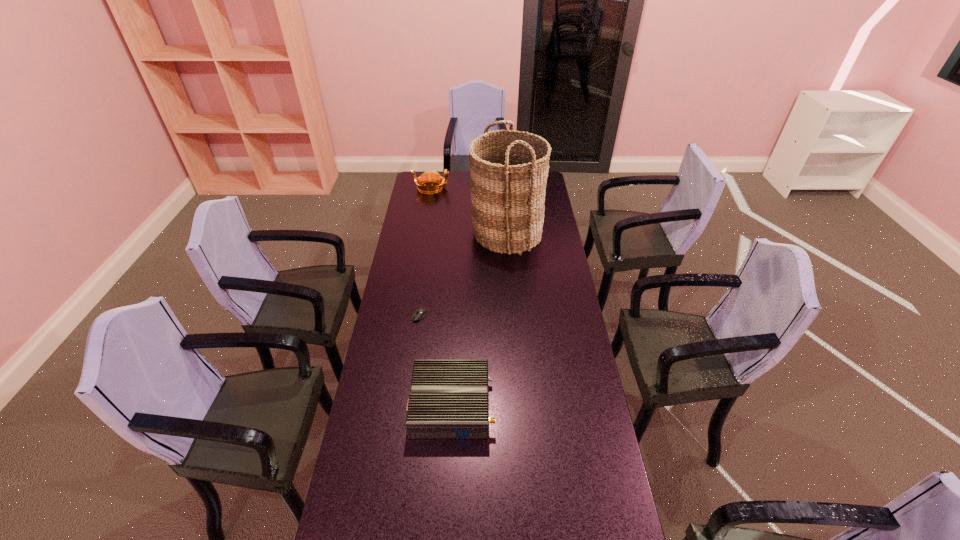
Identify the location of free space located on the back panel of the nearest object. [581, 405].

This screenshot has width=960, height=540. Find the location of `vacant space located on the front of the third farthest object`. vacant space located on the front of the third farthest object is located at coordinates (408, 389).

Locate an element on the screen. This screenshot has height=540, width=960. object located in the far edge section of the desktop is located at coordinates (429, 176).

You are a GUI agent. You are given a task and a screenshot of the screen. Output one action in this format:
    pyautogui.click(x=<x>, y=<y>)
    Task: Click on the tiara situated at the left edge
    
    Given the screenshot: What is the action you would take?
    pyautogui.click(x=429, y=176)

Where is `router that is at the left edge`? The width and height of the screenshot is (960, 540). router that is at the left edge is located at coordinates (449, 399).

Identify the location of computer mouse that is at the left edge. The image size is (960, 540). (419, 313).

The width and height of the screenshot is (960, 540). In order to click on object situated at the right edge in this screenshot , I will do `click(509, 169)`.

The width and height of the screenshot is (960, 540). Find the location of `object that is at the far left corner`. object that is at the far left corner is located at coordinates (429, 176).

This screenshot has height=540, width=960. Find the location of `vacant space at the left edge of the desktop`. vacant space at the left edge of the desktop is located at coordinates (401, 365).

You are a GUI agent. You are given a task and a screenshot of the screen. Output one action in this format:
    pyautogui.click(x=<x>, y=<y>)
    Task: Click on the blank space at the right edge of the desktop
    The height and width of the screenshot is (540, 960).
    Given the screenshot: What is the action you would take?
    pyautogui.click(x=600, y=420)